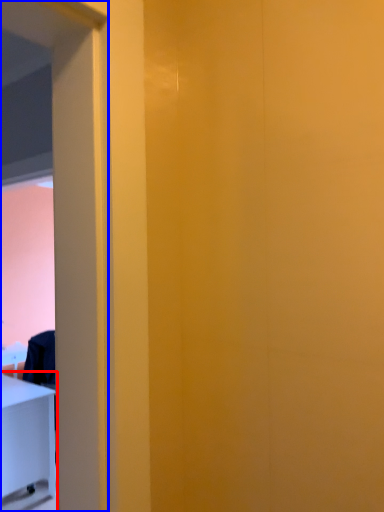
Question: Which point is closer to the camera, furniture (highlighted by a red box) or screen door (highlighted by a blue box)?

Choices:
 (A) furniture
 (B) screen door

Answer: (B)